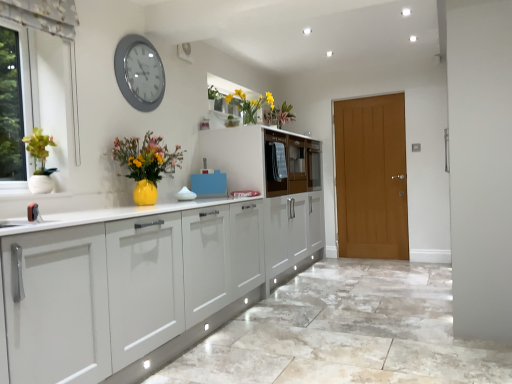
Question: Can matte yellow vase at center be found inside yellow matte vase at upper center?

Choices:
 (A) yes
 (B) no

Answer: (B)

Question: Does yellow matte vase at upper center have a lesser height compared to matte yellow vase at center?

Choices:
 (A) no
 (B) yes

Answer: (B)

Question: From the image's perspective, would you say yellow matte vase at upper center is shown under matte yellow vase at center?

Choices:
 (A) yes
 (B) no

Answer: (B)

Question: Is yellow matte vase at upper center directly adjacent to matte yellow vase at center?

Choices:
 (A) no
 (B) yes

Answer: (A)

Question: Is yellow matte vase at upper center outside matte yellow vase at center?

Choices:
 (A) no
 (B) yes

Answer: (B)

Question: Does yellow matte vase at upper center have a larger size compared to matte yellow vase at center?

Choices:
 (A) no
 (B) yes

Answer: (A)

Question: Can you confirm if wooden cabinet at center is smaller than blue plastic cutting board at center?

Choices:
 (A) no
 (B) yes

Answer: (A)

Question: From a real-world perspective, is wooden cabinet at center on blue plastic cutting board at center?

Choices:
 (A) yes
 (B) no

Answer: (A)

Question: Considering the relative positions of wooden cabinet at center and blue plastic cutting board at center in the image provided, is wooden cabinet at center to the left of blue plastic cutting board at center from the viewer's perspective?

Choices:
 (A) yes
 (B) no

Answer: (B)

Question: Does wooden cabinet at center have a lesser width compared to blue plastic cutting board at center?

Choices:
 (A) yes
 (B) no

Answer: (B)

Question: Is the depth of wooden cabinet at center less than that of blue plastic cutting board at center?

Choices:
 (A) no
 (B) yes

Answer: (A)

Question: Considering the relative positions of wooden cabinet at center and blue plastic cutting board at center in the image provided, is wooden cabinet at center behind blue plastic cutting board at center?

Choices:
 (A) yes
 (B) no

Answer: (A)

Question: Does wooden cabinet at center have a lesser width compared to matte yellow vase at center?

Choices:
 (A) no
 (B) yes

Answer: (A)